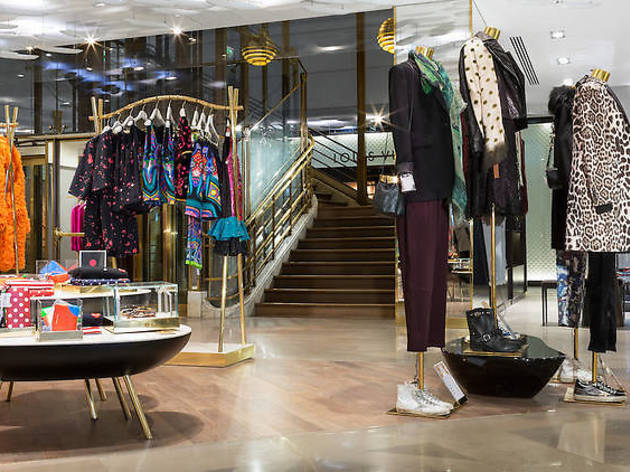
Locate an element on the screen. This screenshot has height=472, width=630. mannequin is located at coordinates (428, 52), (496, 33), (598, 84).